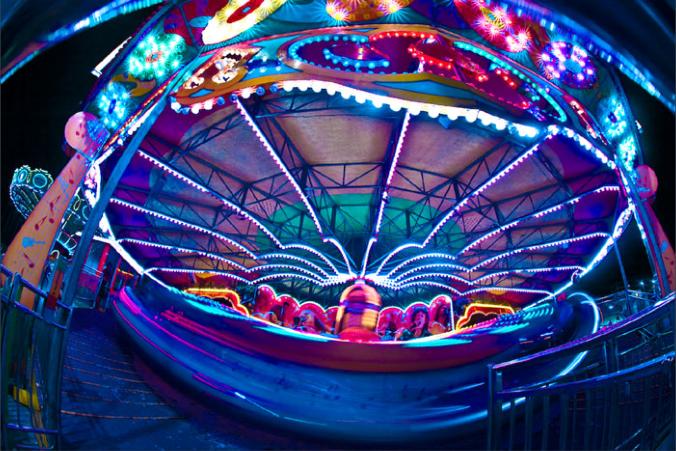
This screenshot has height=451, width=676. What are the coordinates of `ceiling` in the screenshot? It's located at (425, 158), (320, 144), (249, 159), (508, 185).